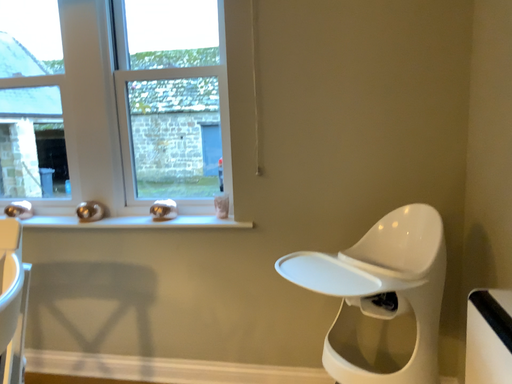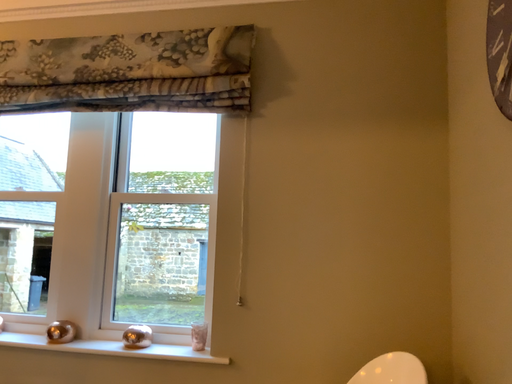
Question: How did the camera likely rotate when shooting the video?

Choices:
 (A) rotated downward
 (B) rotated upward

Answer: (B)